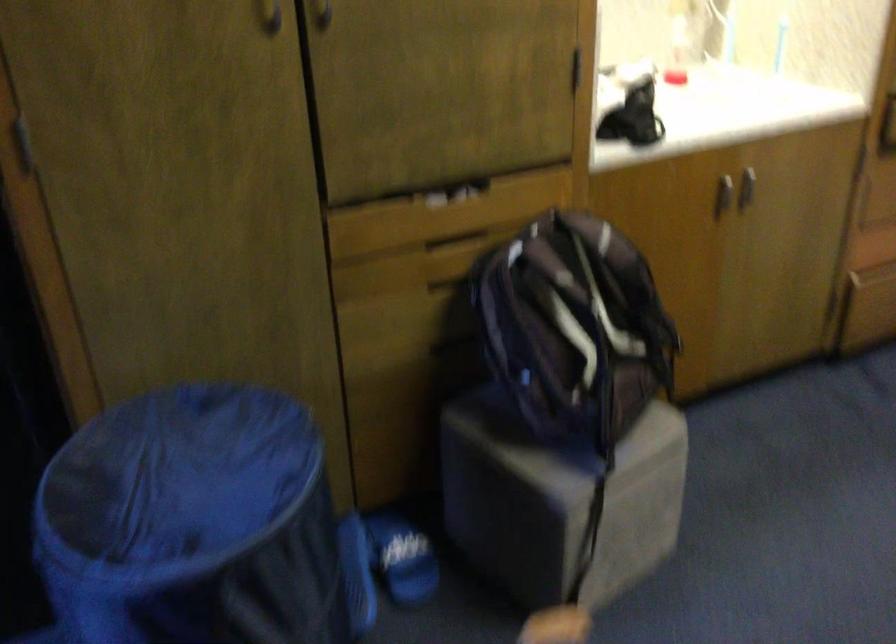
Which object does [193,523] point to?

It corresponds to the blue laundry hamper in the image.